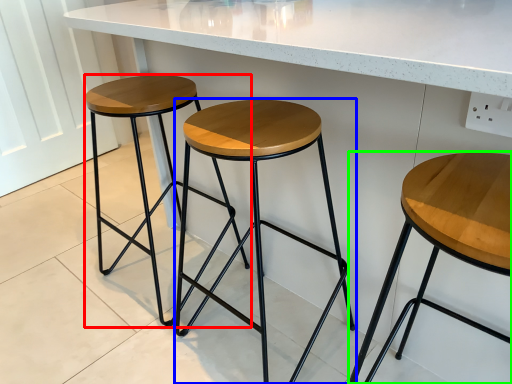
Question: Considering the real-world distances, which object is farthest from stool (highlighted by a red box)? stool (highlighted by a blue box) or stool (highlighted by a green box)?

Choices:
 (A) stool
 (B) stool

Answer: (B)